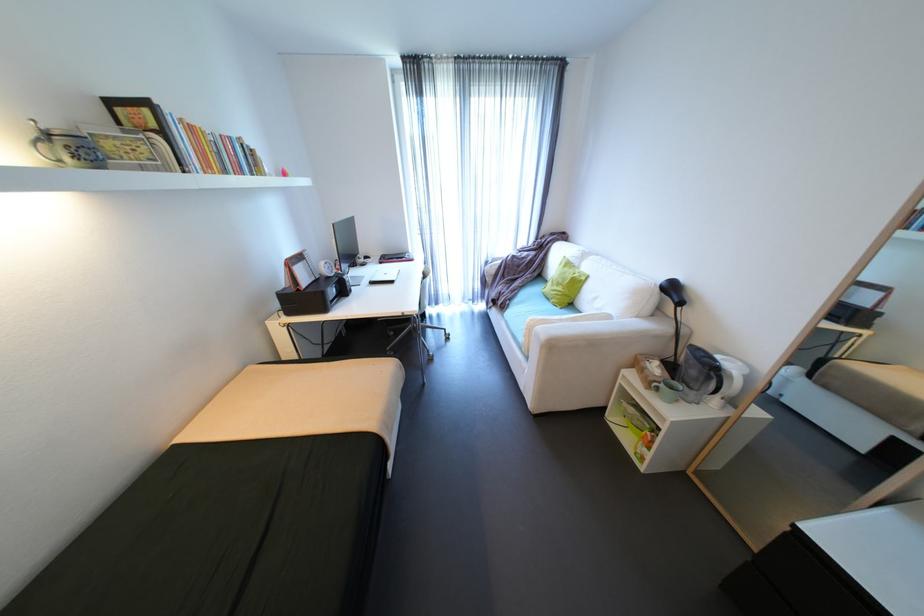
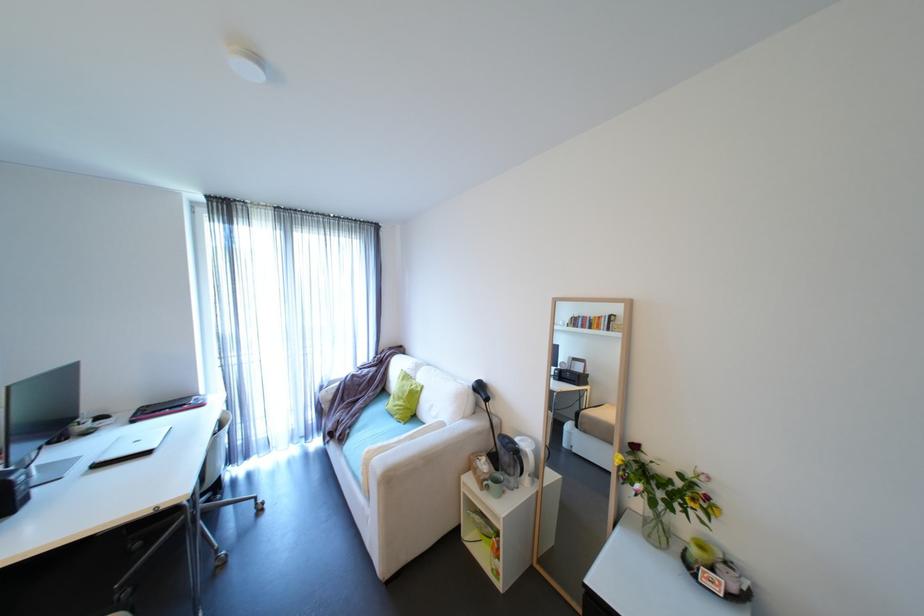
Where in the second image is the point corresponding to pixel 615 317 from the first image?

(450, 424)